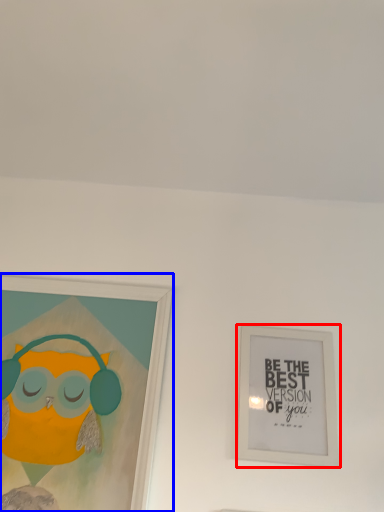
Question: Which point is further to the camera, picture frame (highlighted by a red box) or picture frame (highlighted by a blue box)?

Choices:
 (A) picture frame
 (B) picture frame

Answer: (A)